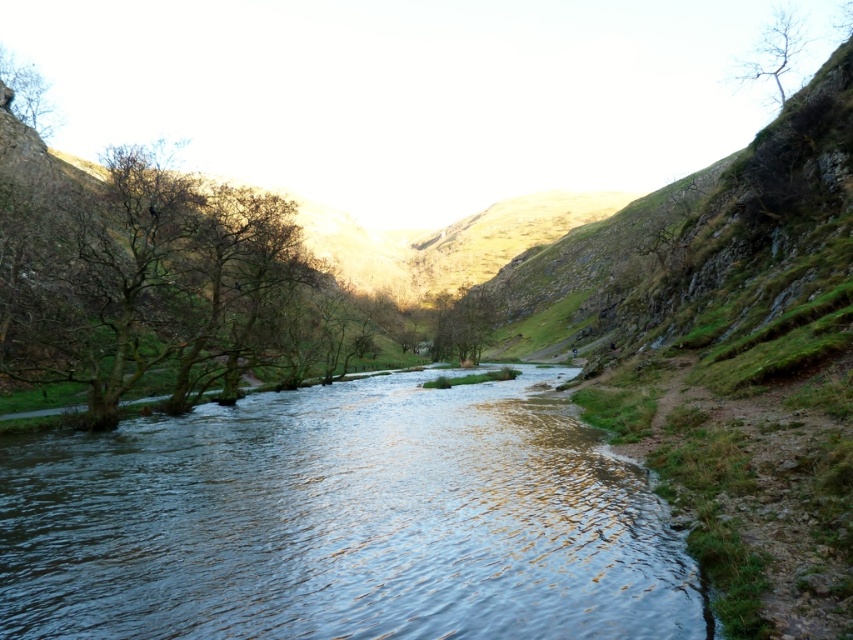
Question: Is green matte tree at center behind brown leafless tree at upper left?

Choices:
 (A) yes
 (B) no

Answer: (A)

Question: Which point is farther to the camera?

Choices:
 (A) clear water at center
 (B) bare branches at left
 (C) brown leafless tree at upper left
 (D) green matte tree at center

Answer: (D)

Question: Can you confirm if bare branches at left is positioned to the right of green matte tree at center?

Choices:
 (A) yes
 (B) no

Answer: (B)

Question: Does clear water at center have a greater width compared to green matte tree at center?

Choices:
 (A) no
 (B) yes

Answer: (B)

Question: Which object is positioned farthest from the bare branches at upper right?

Choices:
 (A) bare branches at left
 (B) clear water at center

Answer: (A)

Question: Among these objects, which one is nearest to the camera?

Choices:
 (A) bare branches at left
 (B) brown leafless tree at upper left
 (C) green matte tree at center
 (D) bare branches at upper right

Answer: (A)